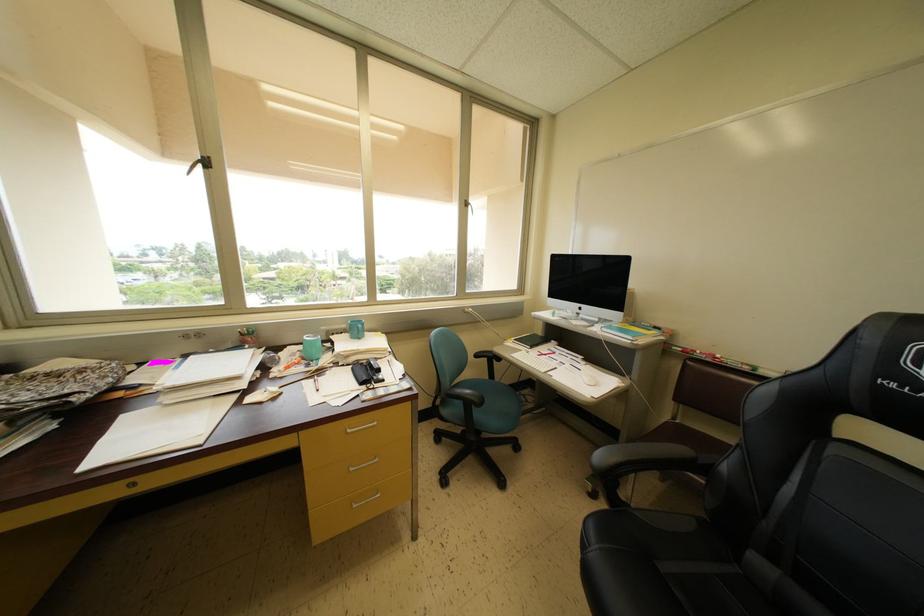
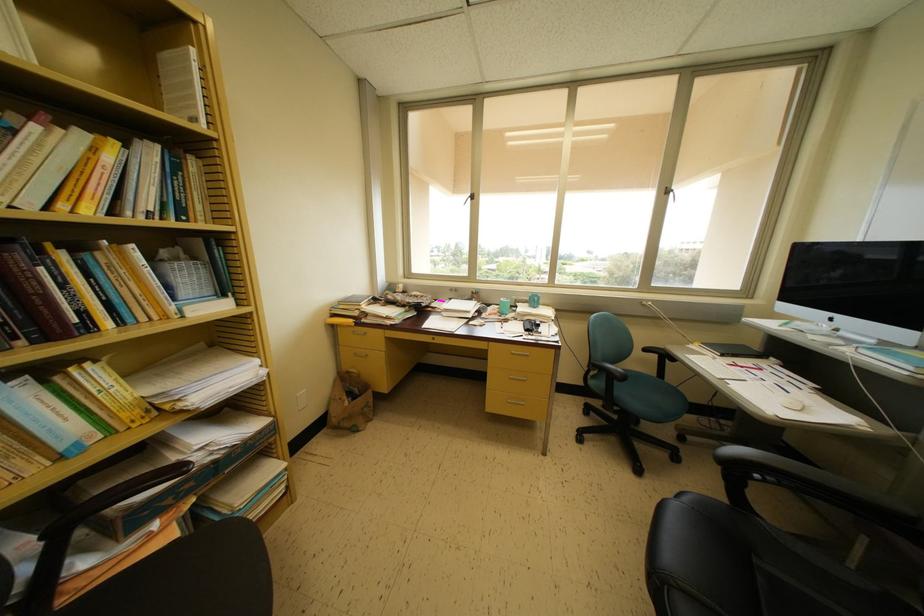
In the second image, find the point that corresponds to the point at 538,418 in the first image.

(730, 448)